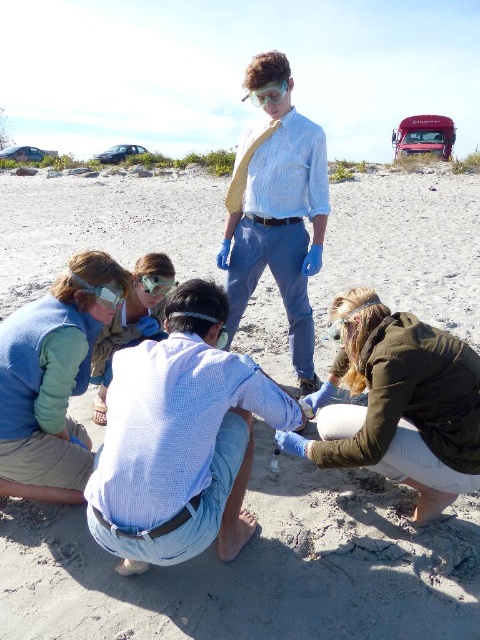
Is light blue shirt at center to the left of matte blue shirt at lower left from the viewer's perspective?

Incorrect, light blue shirt at center is not on the left side of matte blue shirt at lower left.

Measure the distance between point [294,333] and camera.

Point [294,333] is 14.05 feet away from camera.

You are a GUI agent. You are given a task and a screenshot of the screen. Output one action in this format:
    pyautogui.click(x=<x>, y=<y>)
    Task: Click on the light blue shirt at center
    This screenshot has width=480, height=640.
    Given the screenshot: What is the action you would take?
    pyautogui.click(x=276, y=212)

Is blue checkered shirt at center smaller than clear plastic goggles at center?

Incorrect, blue checkered shirt at center is not smaller in size than clear plastic goggles at center.

This screenshot has width=480, height=640. Find the location of `blue checkered shirt at center`. blue checkered shirt at center is located at coordinates (180, 440).

Based on the photo, between smooth sand at center and green fuzzy jacket at lower right, which one has more height?

smooth sand at center is taller.

What do you see at coordinates (255, 570) in the screenshot? I see `smooth sand at center` at bounding box center [255, 570].

Which is behind, point (370, 220) or point (458, 440)?

The point (370, 220) is more distant.

Image resolution: width=480 pixels, height=640 pixels. Find the location of `smooth sand at center`. smooth sand at center is located at coordinates (255, 570).